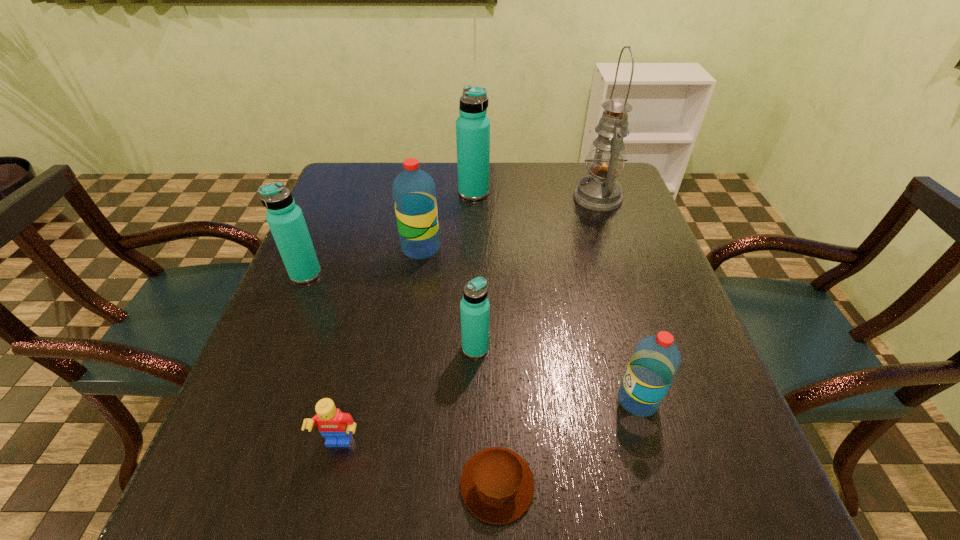
This screenshot has height=540, width=960. Find the location of `empty space that is in between the second biggest blue water bottle and the farther red water bottle`. empty space that is in between the second biggest blue water bottle and the farther red water bottle is located at coordinates tap(363, 261).

This screenshot has height=540, width=960. Find the location of `free spot between the leftmost object and the second farthest water bottle`. free spot between the leftmost object and the second farthest water bottle is located at coordinates (363, 261).

Find the location of a particular element. Image resolution: width=960 pixels, height=540 pixels. free space between the Lego and the rightmost water bottle is located at coordinates (489, 423).

Identify the location of free spot between the tallest object and the farthest water bottle. The height and width of the screenshot is (540, 960). (536, 195).

This screenshot has width=960, height=540. I want to click on blank region between the tallest object and the left red water bottle, so click(x=510, y=223).

Locate an element on the screen. This screenshot has width=960, height=540. free space between the brown muffin and the gray oil lamp is located at coordinates (547, 341).

Locate which object is the sixth closest to the shortest object. Please provide its 2D coordinates. Your answer should be formatted as a tuple, i.e. [(x, y)], where the tuple contains the x and y coordinates of a point satisfying the conditions above.

[(599, 191)]

Identify which object is the fourth nearest to the second water bottle from left to right. Please provide its 2D coordinates. Your answer should be formatted as a tuple, i.e. [(x, y)], where the tuple contains the x and y coordinates of a point satisfying the conditions above.

[(599, 191)]

I want to click on water bottle that can be found as the closest to the leftmost water bottle, so click(414, 193).

You are a GUI agent. You are given a task and a screenshot of the screen. Output one action in this format:
    pyautogui.click(x=<x>, y=<y>)
    Task: Click on the water bottle that stands as the closest to the brown muffin
    
    Given the screenshot: What is the action you would take?
    pyautogui.click(x=655, y=361)